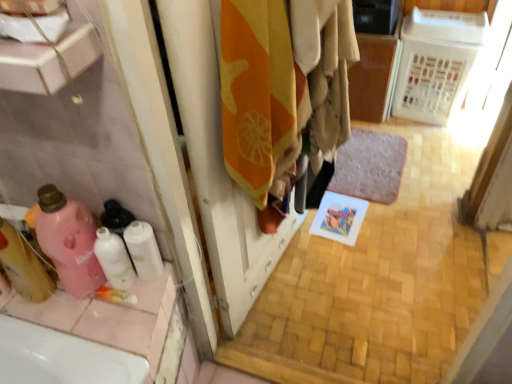
Where is `free spot in front of orange fabric at center`? Image resolution: width=512 pixels, height=384 pixels. free spot in front of orange fabric at center is located at coordinates (294, 327).